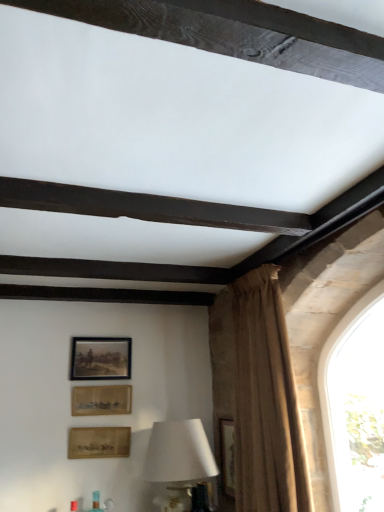
You are a GUI agent. You are given a task and a screenshot of the screen. Output one action in this format:
    pyautogui.click(x=<x>, y=<y>)
    Task: Click on the wooden textured picture frame at lower center, placed as the second picture frame when sorted from bottom to top
    
    Given the screenshot: What is the action you would take?
    pyautogui.click(x=101, y=400)

In order to face white matte table lamp at lower center, should I rotate leftwards or rightwards?

Turn left by 1.645 degrees to look at white matte table lamp at lower center.

Identify the location of wooden frame at upper center, which is counted as the 1th picture frame, starting from the top. This screenshot has height=512, width=384. (100, 358).

Locate an element on the screen. wooden textured picture frame at lower center, placed as the second picture frame when sorted from bottom to top is located at coordinates (101, 400).

How many degrees apart are the facing directions of brown textured curtain at right and wooden textured picture frame at lower center, placed as the second picture frame when sorted from bottom to top?

The facing directions of brown textured curtain at right and wooden textured picture frame at lower center, placed as the second picture frame when sorted from bottom to top, are 92.3 degrees apart.

From the picture: Is wooden textured picture frame at lower center, the second picture frame in the top-to-bottom sequence, surrounded by brown textured curtain at right?

No.

Measure the distance from brown textured curtain at right to wooden textured picture frame at lower center, the second picture frame in the top-to-bottom sequence.

brown textured curtain at right is 78.49 centimeters from wooden textured picture frame at lower center, the second picture frame in the top-to-bottom sequence.

From the image's perspective, between brown textured curtain at right and wooden textured picture frame at lower center, the second picture frame in the top-to-bottom sequence, who is located below?

wooden textured picture frame at lower center, the second picture frame in the top-to-bottom sequence, from the image's perspective.

Consider the image. Considering the relative positions of white matte table lamp at lower center and wooden textured picture frame at lower center, placed as the second picture frame when sorted from bottom to top, in the image provided, is white matte table lamp at lower center behind wooden textured picture frame at lower center, placed as the second picture frame when sorted from bottom to top,?

No, it is in front of wooden textured picture frame at lower center, placed as the second picture frame when sorted from bottom to top.

Is white matte table lamp at lower center turned away from wooden textured picture frame at lower center, the second picture frame in the top-to-bottom sequence?

No.

Locate an element on the screen. This screenshot has height=512, width=384. picture frame that is the 2nd one when counting backward from the white matte table lamp at lower center is located at coordinates (101, 400).

Does point (196, 420) come in front of point (116, 388)?

Yes, point (196, 420) is closer to viewer.

Considering the relative sizes of wooden textured picture frame at lower center, placed as the second picture frame when sorted from bottom to top, and wooden framed picture at lower center, which is counted as the 1th picture frame, starting from the bottom, in the image provided, is wooden textured picture frame at lower center, placed as the second picture frame when sorted from bottom to top, thinner than wooden framed picture at lower center, which is counted as the 1th picture frame, starting from the bottom,?

No.

Consider the image. Is wooden textured picture frame at lower center, the second picture frame in the top-to-bottom sequence, positioned before wooden framed picture at lower center, which is counted as the 1th picture frame, starting from the bottom?

No, it is behind wooden framed picture at lower center, which is counted as the 1th picture frame, starting from the bottom.

Considering the relative sizes of wooden textured picture frame at lower center, the second picture frame in the top-to-bottom sequence, and wooden framed picture at lower center, which is counted as the 1th picture frame, starting from the bottom, in the image provided, is wooden textured picture frame at lower center, the second picture frame in the top-to-bottom sequence, smaller than wooden framed picture at lower center, which is counted as the 1th picture frame, starting from the bottom,?

No, wooden textured picture frame at lower center, the second picture frame in the top-to-bottom sequence, is not smaller than wooden framed picture at lower center, which is counted as the 1th picture frame, starting from the bottom.

From a real-world perspective, is wooden textured picture frame at lower center, placed as the second picture frame when sorted from bottom to top, physically below wooden framed picture at lower center, the third picture frame viewed from the top?

No.

This screenshot has width=384, height=512. What are the coordinates of `the 1st picture frame counting from the left side of the white matte table lamp at lower center` in the screenshot? It's located at (99, 442).

Which object is positioned more to the right, white matte table lamp at lower center or wooden framed picture at lower center, which is counted as the 1th picture frame, starting from the bottom?

white matte table lamp at lower center is more to the right.

From the image's perspective, is white matte table lamp at lower center below wooden framed picture at lower center, the third picture frame viewed from the top?

Yes.

Consider the image. Is white matte table lamp at lower center inside the boundaries of wooden framed picture at lower center, which is counted as the 1th picture frame, starting from the bottom, or outside?

white matte table lamp at lower center exists outside the volume of wooden framed picture at lower center, which is counted as the 1th picture frame, starting from the bottom.

In terms of size, does wooden textured picture frame at lower center, the second picture frame in the top-to-bottom sequence, appear bigger or smaller than white matte table lamp at lower center?

wooden textured picture frame at lower center, the second picture frame in the top-to-bottom sequence, is smaller than white matte table lamp at lower center.

Looking at this image, from a real-world perspective, is wooden textured picture frame at lower center, the second picture frame in the top-to-bottom sequence, physically located above or below white matte table lamp at lower center?

In terms of real-world spatial position, wooden textured picture frame at lower center, the second picture frame in the top-to-bottom sequence, is above white matte table lamp at lower center.

Is wooden textured picture frame at lower center, the second picture frame in the top-to-bottom sequence, to the right of white matte table lamp at lower center from the viewer's perspective?

In fact, wooden textured picture frame at lower center, the second picture frame in the top-to-bottom sequence, is to the left of white matte table lamp at lower center.

Considering the sizes of objects wooden textured picture frame at lower center, placed as the second picture frame when sorted from bottom to top, and white matte table lamp at lower center in the image provided, who is taller, wooden textured picture frame at lower center, placed as the second picture frame when sorted from bottom to top, or white matte table lamp at lower center?

With more height is white matte table lamp at lower center.

Is white matte table lamp at lower center oriented towards wooden frame at upper center, which is counted as the third picture frame, starting from the bottom?

No, white matte table lamp at lower center is not oriented towards wooden frame at upper center, which is counted as the third picture frame, starting from the bottom.

From a real-world perspective, is white matte table lamp at lower center beneath wooden frame at upper center, which is counted as the 1th picture frame, starting from the top?

Yes, from a real-world perspective, white matte table lamp at lower center is beneath wooden frame at upper center, which is counted as the 1th picture frame, starting from the top.

Considering the sizes of objects wooden frame at upper center, which is counted as the third picture frame, starting from the bottom, and white matte table lamp at lower center in the image provided, who is taller, wooden frame at upper center, which is counted as the third picture frame, starting from the bottom, or white matte table lamp at lower center?

white matte table lamp at lower center is taller.

In the scene shown: Which object is closer to the camera taking this photo, wooden frame at upper center, which is counted as the third picture frame, starting from the bottom, or white matte table lamp at lower center?

white matte table lamp at lower center.

From a real-world perspective, is wooden frame at upper center, which is counted as the 1th picture frame, starting from the top, located higher than white matte table lamp at lower center?

Yes.

Which object is positioned more to the right, wooden frame at upper center, which is counted as the 1th picture frame, starting from the top, or white matte table lamp at lower center?

white matte table lamp at lower center is more to the right.

I want to click on curtain that appears on the right of wooden textured picture frame at lower center, the second picture frame in the top-to-bottom sequence, so click(x=258, y=394).

From the image's perspective, starting from the white matte table lamp at lower center, which picture frame is the 2nd one above? Please provide its 2D coordinates.

[(101, 400)]

Based on their spatial positions, is white matte table lamp at lower center or brown textured curtain at right closer to wooden framed picture at lower center, the third picture frame viewed from the top?

The object closer to wooden framed picture at lower center, the third picture frame viewed from the top, is white matte table lamp at lower center.

When comparing their distances from wooden framed picture at lower center, the third picture frame viewed from the top, does white matte table lamp at lower center or wooden frame at upper center, which is counted as the third picture frame, starting from the bottom, seem closer?

white matte table lamp at lower center lies closer to wooden framed picture at lower center, the third picture frame viewed from the top, than the other object.

Looking at the image, which one is located further to wooden textured picture frame at lower center, placed as the second picture frame when sorted from bottom to top, wooden framed picture at lower center, the third picture frame viewed from the top, or wooden frame at upper center, which is counted as the 1th picture frame, starting from the top?

wooden framed picture at lower center, the third picture frame viewed from the top, is positioned further to the anchor wooden textured picture frame at lower center, placed as the second picture frame when sorted from bottom to top.

Estimate the real-world distances between objects in this image. Which object is closer to wooden textured picture frame at lower center, the second picture frame in the top-to-bottom sequence, brown textured curtain at right or wooden frame at upper center, which is counted as the third picture frame, starting from the bottom?

Among the two, wooden frame at upper center, which is counted as the third picture frame, starting from the bottom, is located nearer to wooden textured picture frame at lower center, the second picture frame in the top-to-bottom sequence.

When comparing their distances from white matte table lamp at lower center, does brown textured curtain at right or wooden frame at upper center, which is counted as the 1th picture frame, starting from the top, seem further?

wooden frame at upper center, which is counted as the 1th picture frame, starting from the top.

When comparing their distances from brown textured curtain at right, does white matte table lamp at lower center or wooden textured picture frame at lower center, placed as the second picture frame when sorted from bottom to top, seem further?

wooden textured picture frame at lower center, placed as the second picture frame when sorted from bottom to top, is positioned further to the anchor brown textured curtain at right.

When comparing their distances from wooden frame at upper center, which is counted as the 1th picture frame, starting from the top, does white matte table lamp at lower center or wooden textured picture frame at lower center, the second picture frame in the top-to-bottom sequence, seem closer?

wooden textured picture frame at lower center, the second picture frame in the top-to-bottom sequence, is closer to wooden frame at upper center, which is counted as the 1th picture frame, starting from the top.

Estimate the real-world distances between objects in this image. Which object is further from wooden textured picture frame at lower center, the second picture frame in the top-to-bottom sequence, brown textured curtain at right or wooden framed picture at lower center, the third picture frame viewed from the top?

brown textured curtain at right lies further to wooden textured picture frame at lower center, the second picture frame in the top-to-bottom sequence, than the other object.

The width and height of the screenshot is (384, 512). What are the coordinates of `picture frame situated between wooden textured picture frame at lower center, placed as the second picture frame when sorted from bottom to top, and white matte table lamp at lower center from left to right` in the screenshot? It's located at (99, 442).

Image resolution: width=384 pixels, height=512 pixels. I want to click on table lamp located between brown textured curtain at right and wooden frame at upper center, which is counted as the 1th picture frame, starting from the top, in the depth direction, so click(178, 461).

Image resolution: width=384 pixels, height=512 pixels. I want to click on picture frame between wooden frame at upper center, which is counted as the third picture frame, starting from the bottom, and wooden framed picture at lower center, the third picture frame viewed from the top, vertically, so click(101, 400).

Find the location of `table lamp between brown textured curtain at right and wooden framed picture at lower center, the third picture frame viewed from the top, along the z-axis`. table lamp between brown textured curtain at right and wooden framed picture at lower center, the third picture frame viewed from the top, along the z-axis is located at coordinates (178, 461).